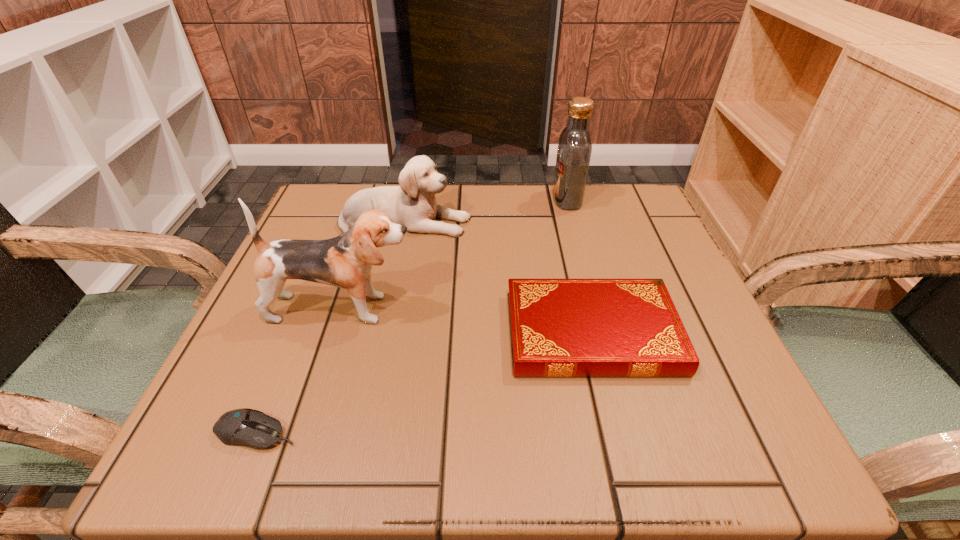
Locate an element on the screen. Image resolution: width=960 pixels, height=540 pixels. vodka that is at the right edge is located at coordinates (574, 151).

Locate an element on the screen. This screenshot has height=540, width=960. hardback book that is at the right edge is located at coordinates (558, 327).

Locate an element on the screen. object that is positioned at the far left corner is located at coordinates (413, 204).

This screenshot has width=960, height=540. Identify the location of object positioned at the near left corner. (246, 427).

Locate an element on the screen. Image resolution: width=960 pixels, height=540 pixels. object situated at the far right corner is located at coordinates (574, 151).

Locate an element on the screen. The height and width of the screenshot is (540, 960). vacant space at the far edge is located at coordinates (510, 210).

Identify the location of blank space at the near edge of the desktop. (319, 456).

Image resolution: width=960 pixels, height=540 pixels. In the image, there is a desktop. Identify the location of vacant space at the left edge. click(x=335, y=297).

The width and height of the screenshot is (960, 540). I want to click on vacant space at the far left corner of the desktop, so click(334, 204).

In order to click on free region at the near left corner in this screenshot , I will do `click(269, 448)`.